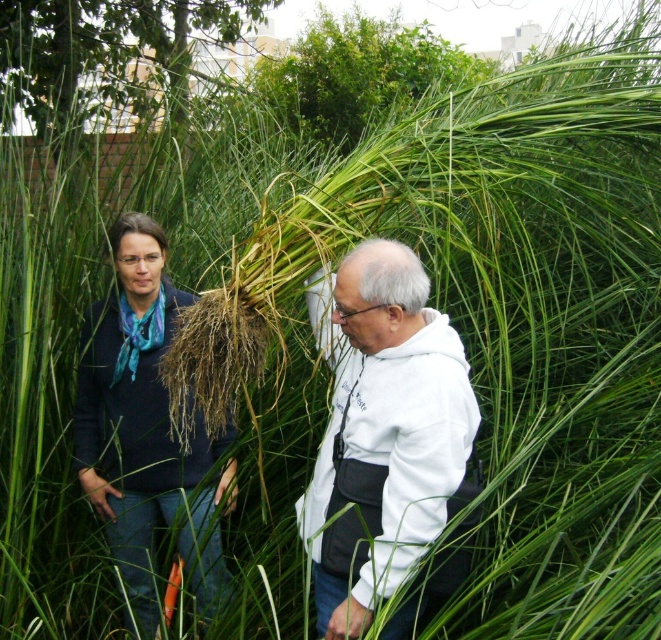
Does point (134, 444) lie in front of point (315, 116)?

Yes, it is.

The width and height of the screenshot is (661, 640). Identify the location of blue fabric scarf at left. (134, 410).

Is point (352, 458) behind point (323, 628)?

No, (352, 458) is closer to viewer.

Looking at this image, which of these two, white fleece jacket at center or white hoodie at center, stands shorter?

white fleece jacket at center

Between point (457, 387) and point (155, 440), which one is positioned behind?

The point (155, 440) is behind.

Locate an element on the screen. white fleece jacket at center is located at coordinates (385, 438).

Is white hoodie at center closer to the viewer compared to green leafy bush at upper center?

Yes, white hoodie at center is closer to the viewer.

Which is in front, point (116, 403) or point (276, 77)?

Point (116, 403) is in front.

Where is `white hoodie at center`? The width and height of the screenshot is (661, 640). white hoodie at center is located at coordinates 134,408.